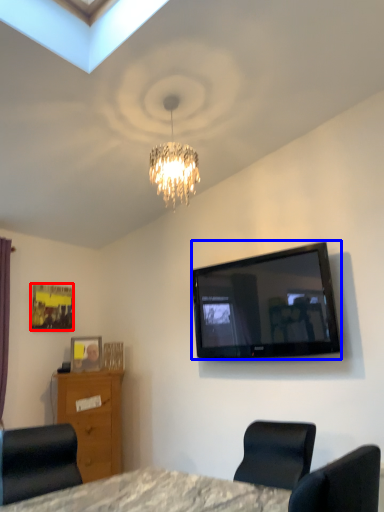
Question: Which object appears farthest to the camera in this image, picture frame (highlighted by a red box) or television (highlighted by a blue box)?

Choices:
 (A) picture frame
 (B) television

Answer: (A)